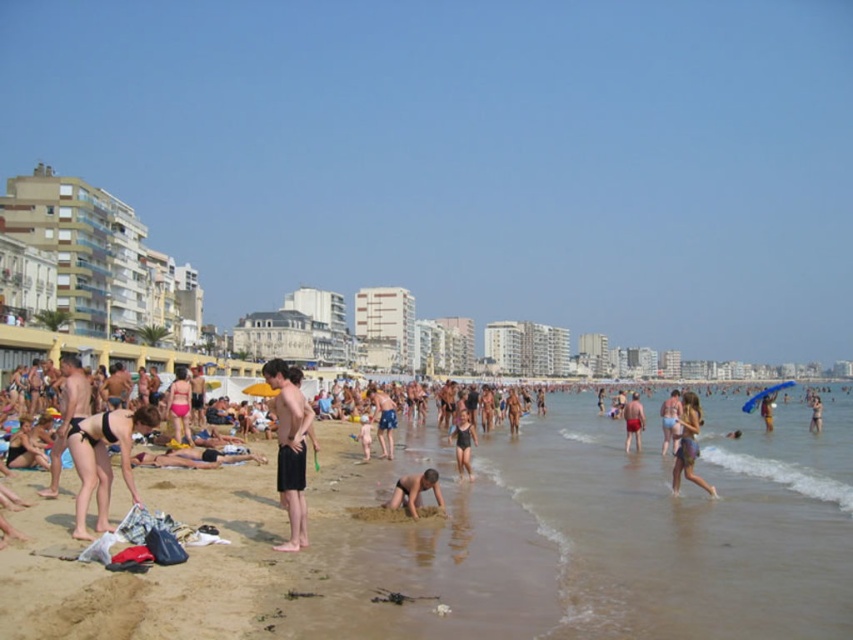
Question: Which point is closer to the camera taking this photo?

Choices:
 (A) pyautogui.click(x=676, y=394)
 (B) pyautogui.click(x=769, y=424)
 (C) pyautogui.click(x=180, y=392)
 (D) pyautogui.click(x=805, y=548)

Answer: (D)

Question: From the image, what is the correct spatial relationship of black swimsuit at center in relation to red matte shorts at center?

Choices:
 (A) right
 (B) left

Answer: (B)

Question: Which object is farther from the camera taking this photo?

Choices:
 (A) pink matte swimsuit at center
 (B) black swimsuit at center

Answer: (A)

Question: Does matte black swimwear at left have a greater width compared to matte pink swimsuit at lower right?

Choices:
 (A) yes
 (B) no

Answer: (B)

Question: Can you confirm if matte black swimwear at left is wider than dark blue shorts at center?

Choices:
 (A) yes
 (B) no

Answer: (A)

Question: Which point is farther to the camera?

Choices:
 (A) pink matte swimsuit at center
 (B) black swimsuit at center
 (C) beige sand at center

Answer: (A)